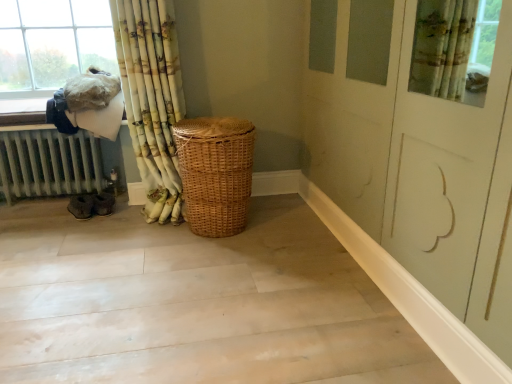
What do you see at coordinates (215, 173) in the screenshot?
I see `woven natural basket at center` at bounding box center [215, 173].

Identify the location of fuzzy white laundry at upper left. The image size is (512, 384). (88, 105).

Where is `bamboo curtain at left`? The height and width of the screenshot is (384, 512). bamboo curtain at left is located at coordinates (152, 98).

Is woven natural basket at center behind bamboo curtain at left?

Yes, woven natural basket at center is further from the viewer.

Is woven natural basket at center looking in the opposite direction of bamboo curtain at left?

woven natural basket at center does not have its back to bamboo curtain at left.

Would you say woven natural basket at center is inside or outside bamboo curtain at left?

woven natural basket at center is outside bamboo curtain at left.

At what (x,y) coordinates should I click in order to perform the action: click on curtain to the left of woven natural basket at center. Please return your answer as a coordinate pair (x, y). The width and height of the screenshot is (512, 384). Looking at the image, I should click on (152, 98).

Who is bigger, woven natural basket at center or fuzzy white laundry at upper left?

woven natural basket at center.

Can you tell me how much woven natural basket at center and fuzzy white laundry at upper left differ in facing direction?

The angular difference between woven natural basket at center and fuzzy white laundry at upper left is 0.714 degrees.

From a real-world perspective, is woven natural basket at center beneath fuzzy white laundry at upper left?

Yes.

Does woven natural basket at center come in front of fuzzy white laundry at upper left?

Yes, woven natural basket at center is closer to the viewer.

What's the angular difference between bamboo curtain at left and woven natural basket at center's facing directions?

They differ by 0.42 degrees in their facing directions.

Is bamboo curtain at left to the left of woven natural basket at center from the viewer's perspective?

Indeed, bamboo curtain at left is positioned on the left side of woven natural basket at center.

From a real-world perspective, which object stands above the other?

In real-world perspective, bamboo curtain at left is above.

Between white painted metal radiator at left and woven natural basket at center, which one has smaller width?

woven natural basket at center.

Is woven natural basket at center located within white painted metal radiator at left?

No, woven natural basket at center is not a part of white painted metal radiator at left.

Can you confirm if white painted metal radiator at left is positioned to the left of woven natural basket at center?

Indeed, white painted metal radiator at left is positioned on the left side of woven natural basket at center.

In order to click on radiator above the woven natural basket at center (from the image's perspective) in this screenshot , I will do `click(49, 164)`.

Is woven natural basket at center bigger than white painted metal radiator at left?

Yes.

Based on the photo, which object is closer to the camera, woven natural basket at center or white painted metal radiator at left?

woven natural basket at center is closer to the camera.

What's the angular difference between woven natural basket at center and white painted metal radiator at left's facing directions?

90.3 degrees.

Is fuzzy white laundry at upper left further to the viewer compared to bamboo curtain at left?

Yes, it is behind bamboo curtain at left.

How different are the orientations of fuzzy white laundry at upper left and bamboo curtain at left in degrees?

1.13 degrees.

Considering the sizes of fuzzy white laundry at upper left and bamboo curtain at left in the image, is fuzzy white laundry at upper left taller or shorter than bamboo curtain at left?

Considering their sizes, fuzzy white laundry at upper left has less height than bamboo curtain at left.

From the image's perspective, is bamboo curtain at left located above or below white painted metal radiator at left?

bamboo curtain at left is situated higher than white painted metal radiator at left in the image.

From a real-world perspective, between bamboo curtain at left and white painted metal radiator at left, who is vertically higher?

bamboo curtain at left, from a real-world perspective.

Which object is further away from the camera taking this photo, bamboo curtain at left or white painted metal radiator at left?

white painted metal radiator at left is further away from the camera.

Could you tell me if bamboo curtain at left is facing white painted metal radiator at left?

No, bamboo curtain at left is not turned towards white painted metal radiator at left.

Find the location of `basket on the right of bamboo curtain at left`. basket on the right of bamboo curtain at left is located at coordinates click(x=215, y=173).

You are a GUI agent. You are given a task and a screenshot of the screen. Output one action in this format:
    pyautogui.click(x=<x>, y=<y>)
    Task: Click on the basket in front of the fuzzy white laundry at upper left
    The width and height of the screenshot is (512, 384).
    Given the screenshot: What is the action you would take?
    pyautogui.click(x=215, y=173)

Considering their positions, is fuzzy white laundry at upper left positioned further to woven natural basket at center than bamboo curtain at left?

Based on the image, fuzzy white laundry at upper left appears to be further to woven natural basket at center.

Looking at the image, which one is located further to fuzzy white laundry at upper left, white painted metal radiator at left or woven natural basket at center?

woven natural basket at center lies further to fuzzy white laundry at upper left than the other object.

When comparing their distances from fuzzy white laundry at upper left, does woven natural basket at center or white painted metal radiator at left seem further?

The object further to fuzzy white laundry at upper left is woven natural basket at center.

Estimate the real-world distances between objects in this image. Which object is further from woven natural basket at center, bamboo curtain at left or white painted metal radiator at left?

Based on the image, white painted metal radiator at left appears to be further to woven natural basket at center.

When comparing their distances from bamboo curtain at left, does woven natural basket at center or fuzzy white laundry at upper left seem further?

woven natural basket at center lies further to bamboo curtain at left than the other object.

From the image, which object appears to be nearer to bamboo curtain at left, fuzzy white laundry at upper left or woven natural basket at center?

Among the two, fuzzy white laundry at upper left is located nearer to bamboo curtain at left.

Which object lies nearer to the anchor point bamboo curtain at left, white painted metal radiator at left or woven natural basket at center?

woven natural basket at center.

From the image, which object appears to be farther from white painted metal radiator at left, woven natural basket at center or fuzzy white laundry at upper left?

The object further to white painted metal radiator at left is woven natural basket at center.

Locate an element on the screen. Image resolution: width=512 pixels, height=384 pixels. curtain located between white painted metal radiator at left and woven natural basket at center in the left-right direction is located at coordinates (152, 98).

This screenshot has height=384, width=512. I want to click on laundry between white painted metal radiator at left and bamboo curtain at left, so click(x=88, y=105).

Find the location of a particular element. The height and width of the screenshot is (384, 512). laundry between white painted metal radiator at left and woven natural basket at center from left to right is located at coordinates (88, 105).

Image resolution: width=512 pixels, height=384 pixels. Find the location of `curtain between fuzzy white laundry at upper left and woven natural basket at center from left to right`. curtain between fuzzy white laundry at upper left and woven natural basket at center from left to right is located at coordinates pyautogui.click(x=152, y=98).